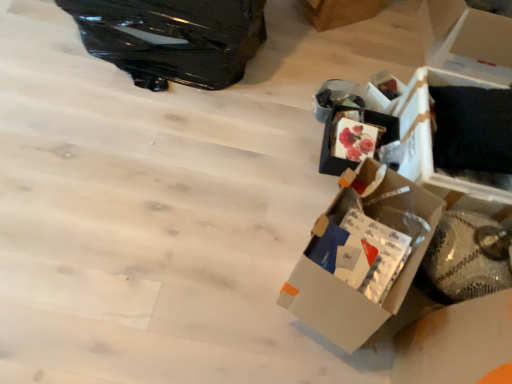
You are a GUI agent. You are given a task and a screenshot of the screen. Output one action in this format:
    pyautogui.click(x=<x>, y=<y>)
    Task: Click on the free location in front of white cardboard box at upper right, placed as the second cardboard box when sorted from right to left
    The image size is (512, 384).
    Given the screenshot: What is the action you would take?
    pyautogui.click(x=329, y=51)